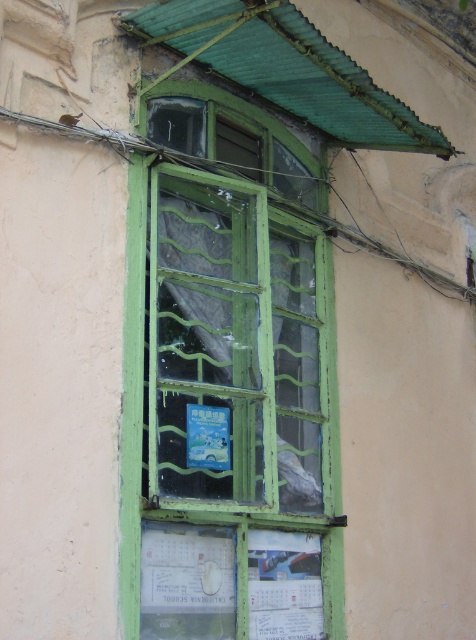
You are standing in a room and looking at the wall. You want to hang a picture exactly at the center of the green painted wood window frame at center. What are the coordinates where you should place the nail?

The coordinates to place the nail are at point (x=228, y=381).

You are standing in front of the window with a green frame. There are two points marked on the wall below the window at coordinates point (275,250) and point (196,573). Which point is closer to you?

Point (275,250) is further to the camera than point (196,573). Therefore, point (196,573) is closer to you.